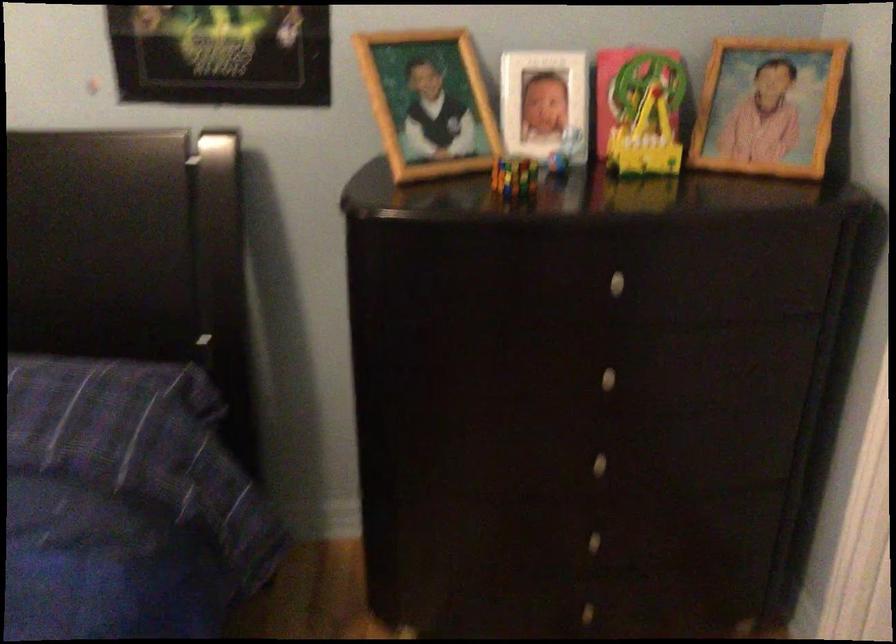
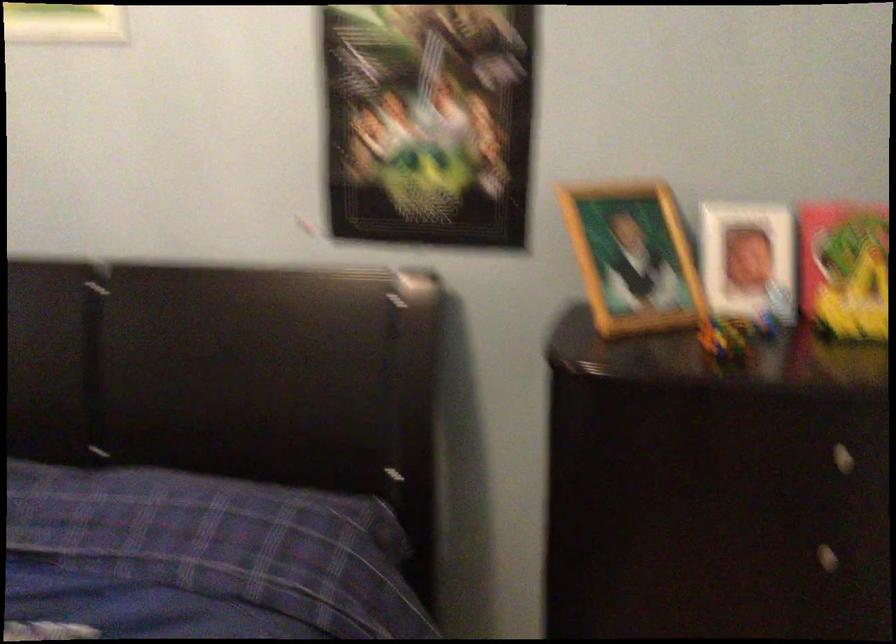
The point at (547, 111) is marked in the first image. Where is the corresponding point in the second image?

(748, 261)